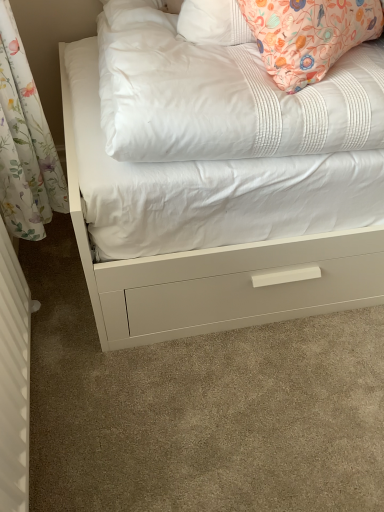
Locate an element on the screen. This screenshot has width=384, height=512. free location to the right of white textured radiator at left is located at coordinates point(147,410).